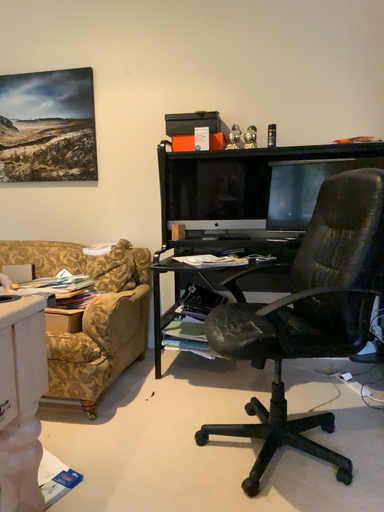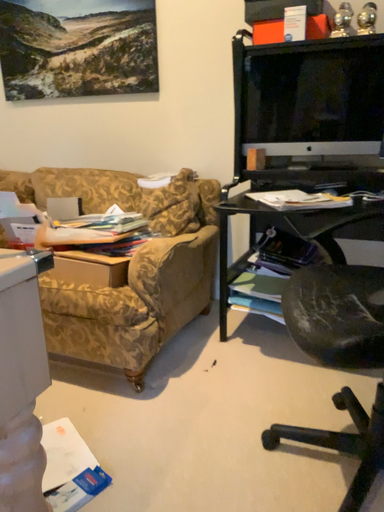
Question: Which way did the camera rotate in the video?

Choices:
 (A) rotated upward
 (B) rotated downward

Answer: (B)